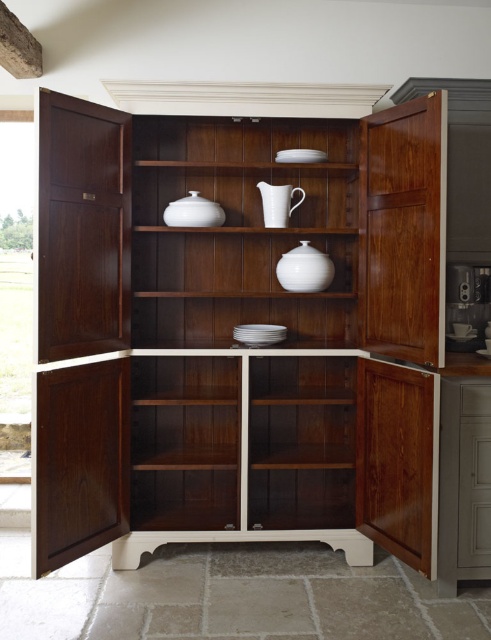
You are an interior designer assessing the placement of items in the cabinet. You need to move the white ceramic pitcher at center to a spot behind the white glossy vase at center. Is this possible without moving the vase?

The white glossy vase at center is closer to the viewer than the white ceramic pitcher at center, so moving the pitcher behind the vase would require placing it further back. Since the vase is already in front, you can move the pitcher behind it without needing to move the vase itself.

You are standing in front of the cabinet and want to reach the point at coordinates point (26, 419). Can you estimate how far you need to walk to reach that point?

The distance between point (26, 419) and the viewer is 4.85 meters, so you need to walk approximately 4.85 meters to reach that point.

You are organizing items on the cabinet and need to place both the white glossy pitcher at center and the white ceramic pitcher at center on the same shelf. Which pitcher should you place first to ensure they both fit?

The white glossy pitcher at center is bigger than the white ceramic pitcher at center, so you should place the white glossy pitcher at center first to ensure both fit on the shelf.